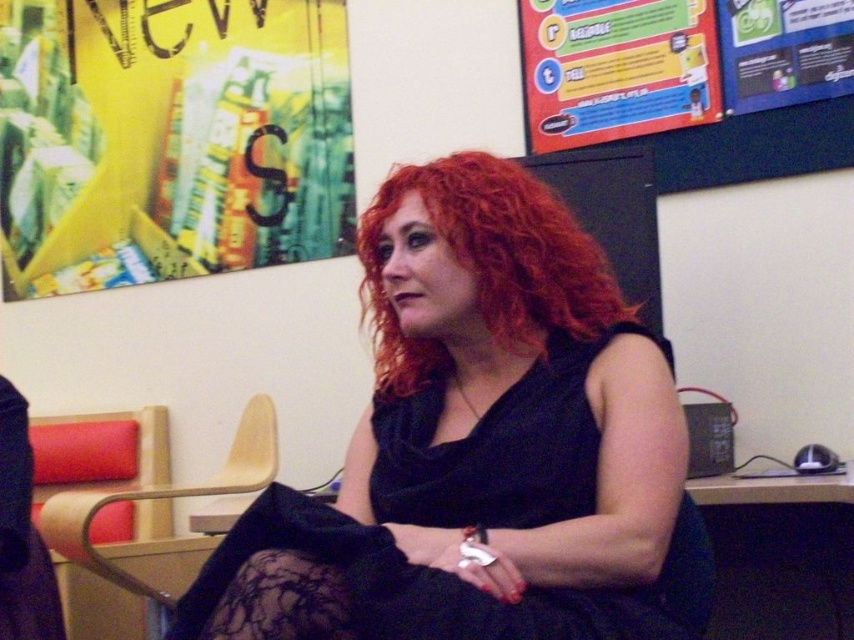
Is black matte dress at center thinner than curly red hair at center?

In fact, black matte dress at center might be wider than curly red hair at center.

Where is `black matte dress at center`? The height and width of the screenshot is (640, 854). black matte dress at center is located at coordinates (481, 445).

Find the location of `black matte dress at center`. black matte dress at center is located at coordinates (481, 445).

Is matte plastic poster at upper center to the left of blue glossy poster at upper right from the viewer's perspective?

Correct, you'll find matte plastic poster at upper center to the left of blue glossy poster at upper right.

The height and width of the screenshot is (640, 854). Describe the element at coordinates (616, 68) in the screenshot. I see `matte plastic poster at upper center` at that location.

Is point (689, 77) more distant than point (845, 16)?

Yes, it is behind point (845, 16).

What are the coordinates of `matte plastic poster at upper center` in the screenshot? It's located at (616, 68).

Does curly red hair at center have a lesser width compared to matte plastic poster at upper center?

Correct, curly red hair at center's width is less than matte plastic poster at upper center's.

Which is below, curly red hair at center or matte plastic poster at upper center?

curly red hair at center is lower down.

Is point (401, 394) farther from viewer compared to point (533, 32)?

No, it is not.

The image size is (854, 640). Identify the location of curly red hair at center. (489, 264).